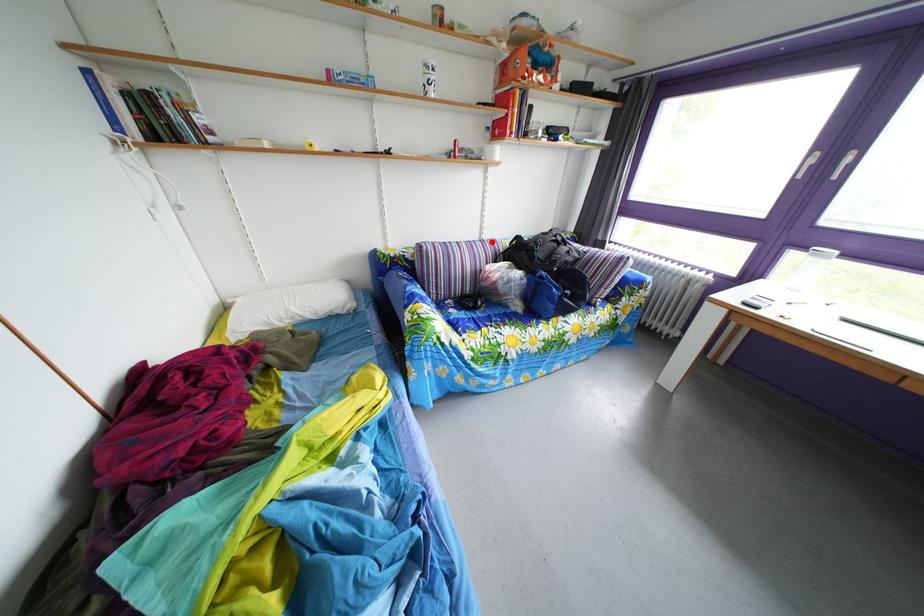
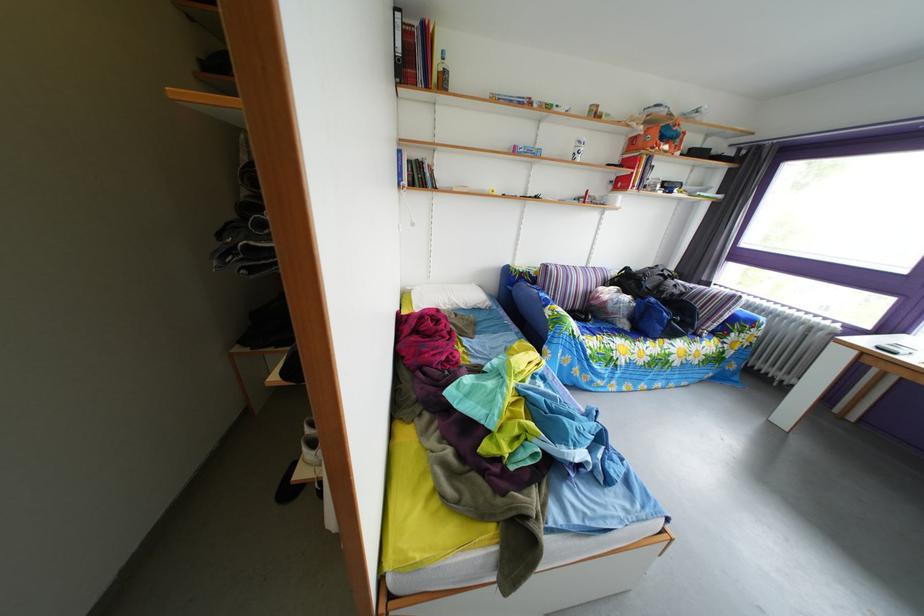
Question: I am providing you with two images of the same scene from different viewpoints. A red point is shown in image1. For the corresponding object point in image2, is it positioned nearer or farther from the camera?

Choices:
 (A) Nearer
 (B) Farther

Answer: (B)